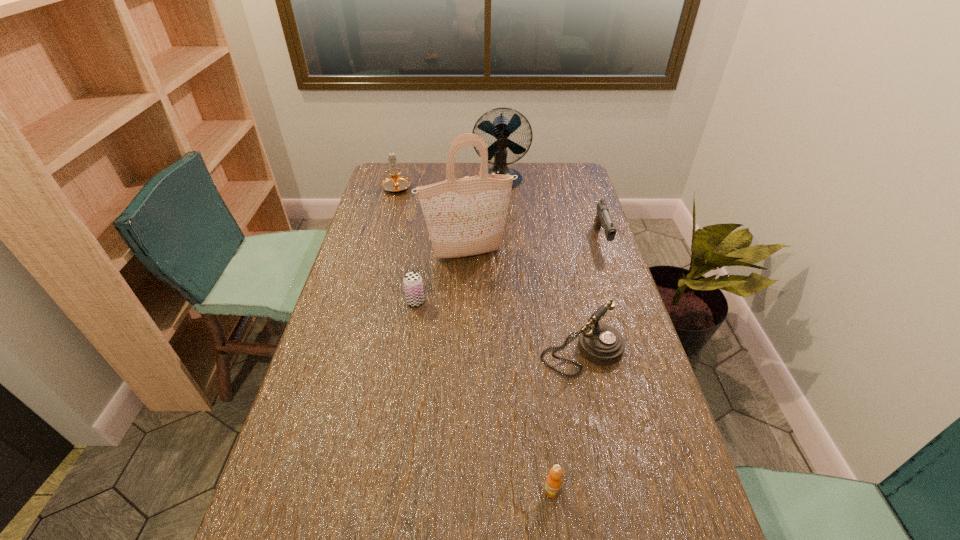
In the image, there is a desktop. Where is `vacant region at the far edge`? vacant region at the far edge is located at coordinates (418, 175).

The height and width of the screenshot is (540, 960). I want to click on free location at the left edge, so click(326, 347).

Where is `vacant space at the right edge of the desktop`? vacant space at the right edge of the desktop is located at coordinates (585, 206).

Locate an element on the screen. The image size is (960, 540). free space at the far right corner is located at coordinates (565, 165).

In order to click on free space between the sixth farthest object and the orange juice in this screenshot , I will do `click(566, 421)`.

Locate an element on the screen. This screenshot has height=540, width=960. empty space between the rightmost object and the beer can is located at coordinates (508, 271).

The width and height of the screenshot is (960, 540). I want to click on free spot between the third nearest object and the telephone, so pos(498,326).

The image size is (960, 540). What are the coordinates of `vacant region between the telephone and the rightmost object` in the screenshot? It's located at (591, 295).

You are a GUI agent. You are given a task and a screenshot of the screen. Output one action in this format:
    pyautogui.click(x=<x>, y=<y>)
    Task: Click on the vacant area between the shopping bag and the beer can
    Image resolution: width=960 pixels, height=540 pixels.
    Given the screenshot: What is the action you would take?
    pyautogui.click(x=442, y=278)

Identify the location of vacant area that lies between the beer can and the tallest object. (442, 278).